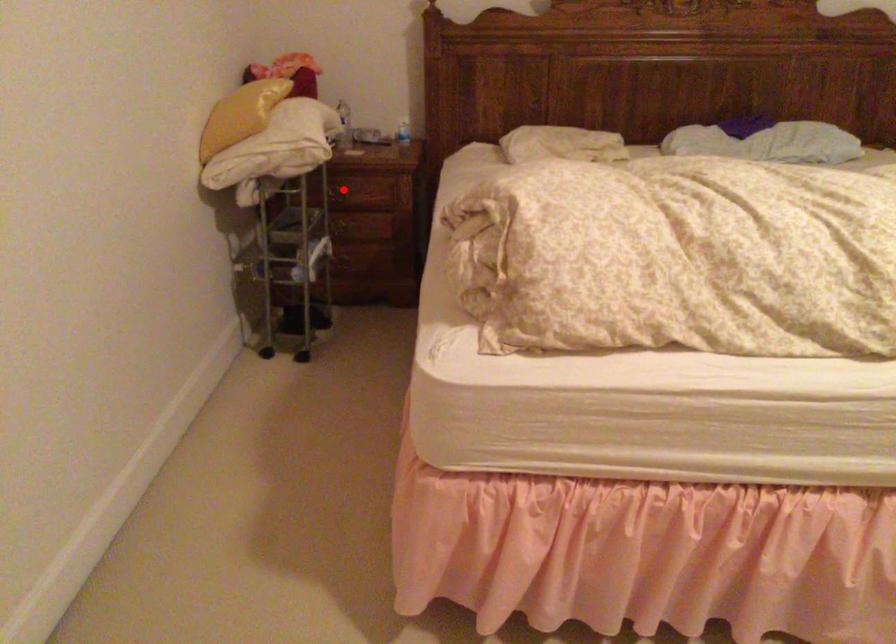
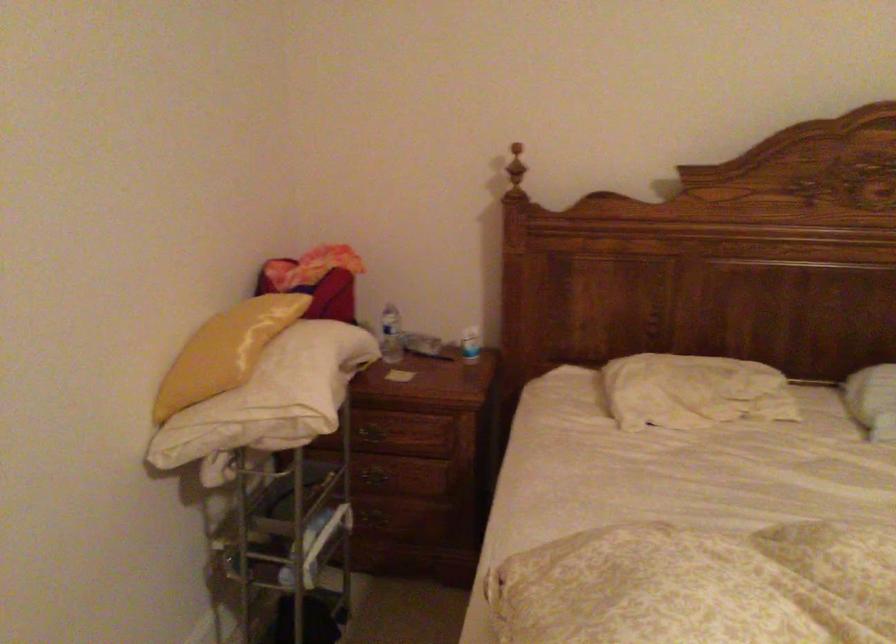
Where in the second image is the point corresponding to the highlighted location from the first image?

(374, 430)